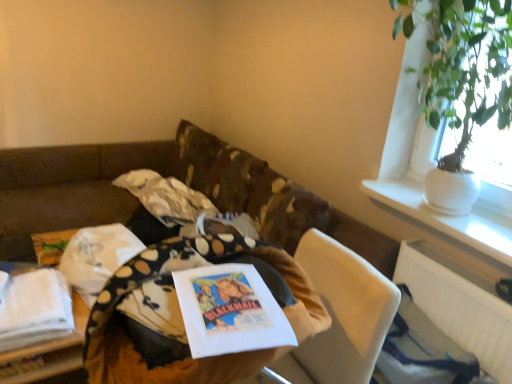
Question: Is wooden table at center, arranged as the 1th table when viewed from the front, completely or partially inside green leafy plant in white pot at upper right?

Choices:
 (A) yes
 (B) no

Answer: (B)

Question: Does green leafy plant in white pot at upper right turn towards wooden table at center, which appears as the second table when viewed from the left?

Choices:
 (A) yes
 (B) no

Answer: (A)

Question: From the image's perspective, does green leafy plant in white pot at upper right appear higher than wooden table at center, placed as the 1th table when sorted from right to left?

Choices:
 (A) yes
 (B) no

Answer: (A)

Question: Can you confirm if green leafy plant in white pot at upper right is smaller than wooden table at center, the second table positioned from the back?

Choices:
 (A) no
 (B) yes

Answer: (A)

Question: Does green leafy plant in white pot at upper right have a larger size compared to wooden table at center, which appears as the second table when viewed from the left?

Choices:
 (A) no
 (B) yes

Answer: (B)

Question: From their relative heights in the image, would you say white fabric at lower left, the second table from the front, is taller or shorter than green leafy plant in white pot at upper right?

Choices:
 (A) tall
 (B) short

Answer: (B)

Question: Considering the positions of point (87, 306) and point (457, 54), is point (87, 306) closer or farther from the camera than point (457, 54)?

Choices:
 (A) closer
 (B) farther

Answer: (B)

Question: In the image, is white fabric at lower left, arranged as the 1th table when viewed from the back, positioned in front of or behind green leafy plant in white pot at upper right?

Choices:
 (A) front
 (B) behind

Answer: (B)

Question: From a real-world perspective, is white fabric at lower left, the second table from the front, positioned above or below green leafy plant in white pot at upper right?

Choices:
 (A) above
 (B) below

Answer: (B)

Question: Looking at their shapes, would you say white ceramic vase at upper right is wider or thinner than white plastic radiator at lower right?

Choices:
 (A) wide
 (B) thin

Answer: (A)

Question: Is white ceramic vase at upper right spatially inside white plastic radiator at lower right, or outside of it?

Choices:
 (A) outside
 (B) inside

Answer: (A)

Question: From the image's perspective, relative to white plastic radiator at lower right, is white ceramic vase at upper right above or below?

Choices:
 (A) below
 (B) above

Answer: (B)

Question: Based on their positions, is white ceramic vase at upper right located to the left or right of white plastic radiator at lower right?

Choices:
 (A) left
 (B) right

Answer: (B)

Question: Considering the positions of green leafy plant in white pot at upper right and white fabric at lower left, arranged as the 1th table when viewed from the back, in the image, is green leafy plant in white pot at upper right bigger or smaller than white fabric at lower left, arranged as the 1th table when viewed from the back,?

Choices:
 (A) big
 (B) small

Answer: (A)

Question: In the image, is green leafy plant in white pot at upper right positioned in front of or behind white fabric at lower left, the first table from the left?

Choices:
 (A) front
 (B) behind

Answer: (A)